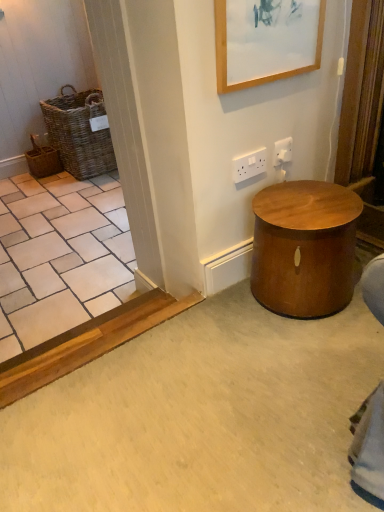
Where is `woven brown basket at left, which is the 1th basket in left-to-right order`? The height and width of the screenshot is (512, 384). woven brown basket at left, which is the 1th basket in left-to-right order is located at coordinates (43, 160).

Describe the element at coordinates (282, 151) in the screenshot. The width and height of the screenshot is (384, 512). I see `white plastic electric outlet at upper right, the second electric outlet in the left-to-right sequence` at that location.

Locate an element on the screen. woven brown basket at left, arranged as the 2th basket when viewed from the right is located at coordinates (43, 160).

Could you tell me if white plastic electric outlet at upper center, marked as the second electric outlet in a right-to-left arrangement, is facing woven brown basket at left, positioned as the 1th basket in right-to-left order?

No, white plastic electric outlet at upper center, marked as the second electric outlet in a right-to-left arrangement, is not facing towards woven brown basket at left, positioned as the 1th basket in right-to-left order.

Considering the relative sizes of white plastic electric outlet at upper center, marked as the second electric outlet in a right-to-left arrangement, and woven brown basket at left, the second basket positioned from the left, in the image provided, is white plastic electric outlet at upper center, marked as the second electric outlet in a right-to-left arrangement, bigger than woven brown basket at left, the second basket positioned from the left,?

Incorrect, white plastic electric outlet at upper center, marked as the second electric outlet in a right-to-left arrangement, is not larger than woven brown basket at left, the second basket positioned from the left.

Can you confirm if white plastic electric outlet at upper center, placed as the 1th electric outlet when sorted from left to right, is positioned to the left of woven brown basket at left, positioned as the 1th basket in right-to-left order?

No, white plastic electric outlet at upper center, placed as the 1th electric outlet when sorted from left to right, is not to the left of woven brown basket at left, positioned as the 1th basket in right-to-left order.

Which is in front, white plastic electric outlet at upper center, placed as the 1th electric outlet when sorted from left to right, or woven brown basket at left, positioned as the 1th basket in right-to-left order?

Positioned in front is white plastic electric outlet at upper center, placed as the 1th electric outlet when sorted from left to right.

Is shiny brown stool at lower right turned away from white plastic electric outlet at upper center, marked as the second electric outlet in a right-to-left arrangement?

No.

Considering the relative sizes of shiny brown stool at lower right and white plastic electric outlet at upper center, placed as the 1th electric outlet when sorted from left to right, in the image provided, is shiny brown stool at lower right shorter than white plastic electric outlet at upper center, placed as the 1th electric outlet when sorted from left to right,?

Incorrect, the height of shiny brown stool at lower right does not fall short of that of white plastic electric outlet at upper center, placed as the 1th electric outlet when sorted from left to right.

From the picture: Which is in front, shiny brown stool at lower right or white plastic electric outlet at upper center, placed as the 1th electric outlet when sorted from left to right?

shiny brown stool at lower right is in front.

Can you tell me how much wooden picture frame at upper center and woven brown basket at left, arranged as the 2th basket when viewed from the right, differ in facing direction?

wooden picture frame at upper center and woven brown basket at left, arranged as the 2th basket when viewed from the right, are facing 0.471 degrees away from each other.

From a real-world perspective, relative to woven brown basket at left, arranged as the 2th basket when viewed from the right, is wooden picture frame at upper center vertically above or below?

wooden picture frame at upper center is situated higher than woven brown basket at left, arranged as the 2th basket when viewed from the right, in the real world.

Which of these two, wooden picture frame at upper center or woven brown basket at left, arranged as the 2th basket when viewed from the right, is wider?

With larger width is woven brown basket at left, arranged as the 2th basket when viewed from the right.

Is wooden picture frame at upper center not within woven brown basket at left, which is the 1th basket in left-to-right order?

That's correct, wooden picture frame at upper center is outside of woven brown basket at left, which is the 1th basket in left-to-right order.

From the image's perspective, who appears lower, woven brown basket at left, positioned as the 1th basket in right-to-left order, or white plastic electric outlet at upper center, placed as the 1th electric outlet when sorted from left to right?

white plastic electric outlet at upper center, placed as the 1th electric outlet when sorted from left to right, from the image's perspective.

Based on the photo, is the depth of woven brown basket at left, positioned as the 1th basket in right-to-left order, less than that of white plastic electric outlet at upper center, marked as the second electric outlet in a right-to-left arrangement?

No, the depth of woven brown basket at left, positioned as the 1th basket in right-to-left order, is greater than that of white plastic electric outlet at upper center, marked as the second electric outlet in a right-to-left arrangement.

In terms of height, does woven brown basket at left, positioned as the 1th basket in right-to-left order, look taller or shorter compared to white plastic electric outlet at upper center, placed as the 1th electric outlet when sorted from left to right?

woven brown basket at left, positioned as the 1th basket in right-to-left order, is taller than white plastic electric outlet at upper center, placed as the 1th electric outlet when sorted from left to right.

Considering the relative sizes of woven brown basket at left, which is the 1th basket in left-to-right order, and woven brown basket at left, positioned as the 1th basket in right-to-left order, in the image provided, is woven brown basket at left, which is the 1th basket in left-to-right order, taller than woven brown basket at left, positioned as the 1th basket in right-to-left order,?

No, woven brown basket at left, which is the 1th basket in left-to-right order, is not taller than woven brown basket at left, positioned as the 1th basket in right-to-left order.

Considering the positions of objects woven brown basket at left, arranged as the 2th basket when viewed from the right, and woven brown basket at left, the second basket positioned from the left, in the image provided, who is more to the right, woven brown basket at left, arranged as the 2th basket when viewed from the right, or woven brown basket at left, the second basket positioned from the left,?

Positioned to the right is woven brown basket at left, the second basket positioned from the left.

Can you confirm if woven brown basket at left, arranged as the 2th basket when viewed from the right, is smaller than woven brown basket at left, the second basket positioned from the left?

Yes.

Considering their positions, is woven brown basket at left, which is the 1th basket in left-to-right order, located in front of or behind woven brown basket at left, the second basket positioned from the left?

Visually, woven brown basket at left, which is the 1th basket in left-to-right order, is located behind woven brown basket at left, the second basket positioned from the left.

Who is smaller, wooden picture frame at upper center or shiny brown stool at lower right?

wooden picture frame at upper center is smaller.

From a real-world perspective, is wooden picture frame at upper center positioned above or below shiny brown stool at lower right?

In terms of real-world spatial position, wooden picture frame at upper center is above shiny brown stool at lower right.

In the scene shown: Can shiny brown stool at lower right be found inside wooden picture frame at upper center?

No, wooden picture frame at upper center does not contain shiny brown stool at lower right.

Considering their positions, is wooden picture frame at upper center located in front of or behind shiny brown stool at lower right?

Clearly, wooden picture frame at upper center is in front of shiny brown stool at lower right.

Does white plastic electric outlet at upper center, placed as the 1th electric outlet when sorted from left to right, appear on the right side of woven brown basket at left, arranged as the 2th basket when viewed from the right?

Correct, you'll find white plastic electric outlet at upper center, placed as the 1th electric outlet when sorted from left to right, to the right of woven brown basket at left, arranged as the 2th basket when viewed from the right.

Is white plastic electric outlet at upper center, placed as the 1th electric outlet when sorted from left to right, situated inside woven brown basket at left, which is the 1th basket in left-to-right order, or outside?

white plastic electric outlet at upper center, placed as the 1th electric outlet when sorted from left to right, exists outside the volume of woven brown basket at left, which is the 1th basket in left-to-right order.

Identify the location of the 2nd basket positioned above the white plastic electric outlet at upper center, marked as the second electric outlet in a right-to-left arrangement (from the image's perspective). The height and width of the screenshot is (512, 384). (79, 132).

At what (x,y) coordinates should I click in order to perform the action: click on stool on the right of white plastic electric outlet at upper center, placed as the 1th electric outlet when sorted from left to right. Please return your answer as a coordinate pair (x, y). Looking at the image, I should click on (304, 248).

Looking at the image, which one is located further to shiny brown stool at lower right, white plastic electric outlet at upper center, marked as the second electric outlet in a right-to-left arrangement, or woven brown basket at left, arranged as the 2th basket when viewed from the right?

woven brown basket at left, arranged as the 2th basket when viewed from the right, lies further to shiny brown stool at lower right than the other object.

Based on the photo, considering their positions, is wooden picture frame at upper center positioned closer to woven brown basket at left, the second basket positioned from the left, than white plastic electric outlet at upper center, marked as the second electric outlet in a right-to-left arrangement?

Based on the image, white plastic electric outlet at upper center, marked as the second electric outlet in a right-to-left arrangement, appears to be nearer to woven brown basket at left, the second basket positioned from the left.

Based on their spatial positions, is shiny brown stool at lower right or white plastic electric outlet at upper center, placed as the 1th electric outlet when sorted from left to right, closer to woven brown basket at left, the second basket positioned from the left?

white plastic electric outlet at upper center, placed as the 1th electric outlet when sorted from left to right, lies closer to woven brown basket at left, the second basket positioned from the left, than the other object.

Looking at the image, which one is located further to woven brown basket at left, which is the 1th basket in left-to-right order, shiny brown stool at lower right or wooden picture frame at upper center?

shiny brown stool at lower right is further to woven brown basket at left, which is the 1th basket in left-to-right order.

When comparing their distances from woven brown basket at left, which is the 1th basket in left-to-right order, does white plastic electric outlet at upper right, the second electric outlet in the left-to-right sequence, or woven brown basket at left, positioned as the 1th basket in right-to-left order, seem closer?

Among the two, woven brown basket at left, positioned as the 1th basket in right-to-left order, is located nearer to woven brown basket at left, which is the 1th basket in left-to-right order.

Based on their spatial positions, is woven brown basket at left, positioned as the 1th basket in right-to-left order, or white plastic electric outlet at upper center, placed as the 1th electric outlet when sorted from left to right, further from wooden picture frame at upper center?

Based on the image, woven brown basket at left, positioned as the 1th basket in right-to-left order, appears to be further to wooden picture frame at upper center.

From the image, which object appears to be nearer to shiny brown stool at lower right, woven brown basket at left, arranged as the 2th basket when viewed from the right, or white plastic electric outlet at upper right, the second electric outlet in the left-to-right sequence?

Among the two, white plastic electric outlet at upper right, the second electric outlet in the left-to-right sequence, is located nearer to shiny brown stool at lower right.

In the scene shown: Considering their positions, is woven brown basket at left, arranged as the 2th basket when viewed from the right, positioned closer to white plastic electric outlet at upper right, the second electric outlet in the left-to-right sequence, than white plastic electric outlet at upper center, placed as the 1th electric outlet when sorted from left to right?

white plastic electric outlet at upper center, placed as the 1th electric outlet when sorted from left to right.

At what (x,y) coordinates should I click in order to perform the action: click on electric outlet between white plastic electric outlet at upper right, the second electric outlet in the left-to-right sequence, and shiny brown stool at lower right from top to bottom. Please return your answer as a coordinate pair (x, y). Looking at the image, I should click on (249, 165).

The height and width of the screenshot is (512, 384). Identify the location of basket located between white plastic electric outlet at upper right, acting as the 1th electric outlet starting from the right, and woven brown basket at left, which is the 1th basket in left-to-right order, in the depth direction. (79, 132).

Find the location of a particular element. This screenshot has height=512, width=384. electric outlet positioned between white plastic electric outlet at upper center, marked as the second electric outlet in a right-to-left arrangement, and woven brown basket at left, arranged as the 2th basket when viewed from the right, from near to far is located at coordinates (x=282, y=151).

You are a GUI agent. You are given a task and a screenshot of the screen. Output one action in this format:
    pyautogui.click(x=<x>, y=<y>)
    Task: Click on the basket positioned between shiny brown stool at lower right and woven brown basket at left, arranged as the 2th basket when viewed from the right, from near to far
    This screenshot has width=384, height=512.
    Given the screenshot: What is the action you would take?
    pyautogui.click(x=79, y=132)